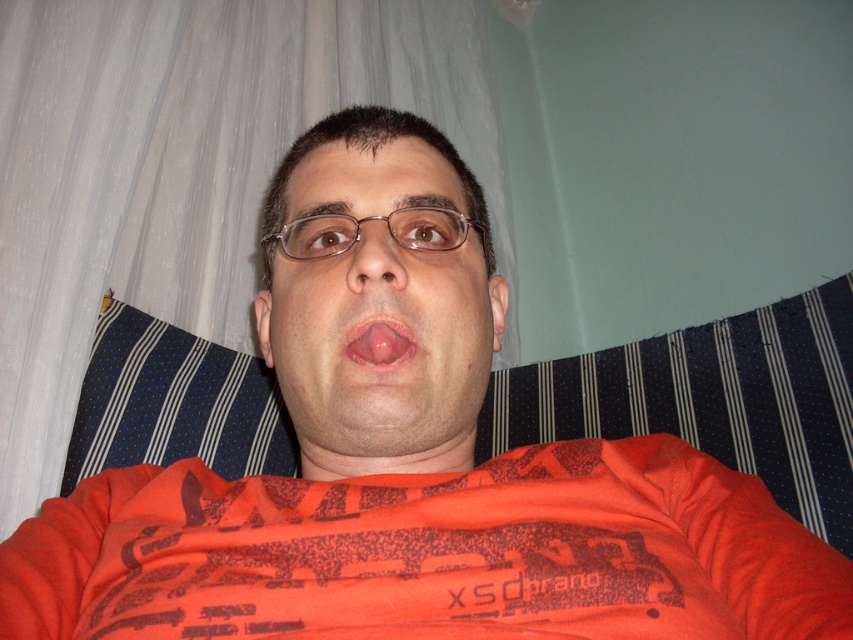
Between matte orange face at center and matte brown nose at center, which one appears on the left side from the viewer's perspective?

From the viewer's perspective, matte brown nose at center appears more on the left side.

Can you confirm if matte orange face at center is wider than matte brown nose at center?

Yes, matte orange face at center is wider than matte brown nose at center.

Between point (492, 337) and point (354, 259), which one is positioned in front?

Point (354, 259)

The width and height of the screenshot is (853, 640). I want to click on matte orange face at center, so click(379, 308).

Is matte brown nose at center bigger than pink glossy tongue at center?

Yes.

Is matte brown nose at center wider than pink glossy tongue at center?

Yes.

The height and width of the screenshot is (640, 853). What do you see at coordinates (374, 259) in the screenshot? I see `matte brown nose at center` at bounding box center [374, 259].

This screenshot has height=640, width=853. In order to click on matte brown nose at center in this screenshot , I will do `click(374, 259)`.

Is matte orange face at center positioned behind pink glossy tongue at center?

No, matte orange face at center is closer to the viewer.

How distant is matte orange face at center from pink glossy tongue at center?

matte orange face at center is 3.14 inches from pink glossy tongue at center.

You are a GUI agent. You are given a task and a screenshot of the screen. Output one action in this format:
    pyautogui.click(x=<x>, y=<y>)
    Task: Click on the matte orange face at center
    This screenshot has width=853, height=640.
    Given the screenshot: What is the action you would take?
    pyautogui.click(x=379, y=308)